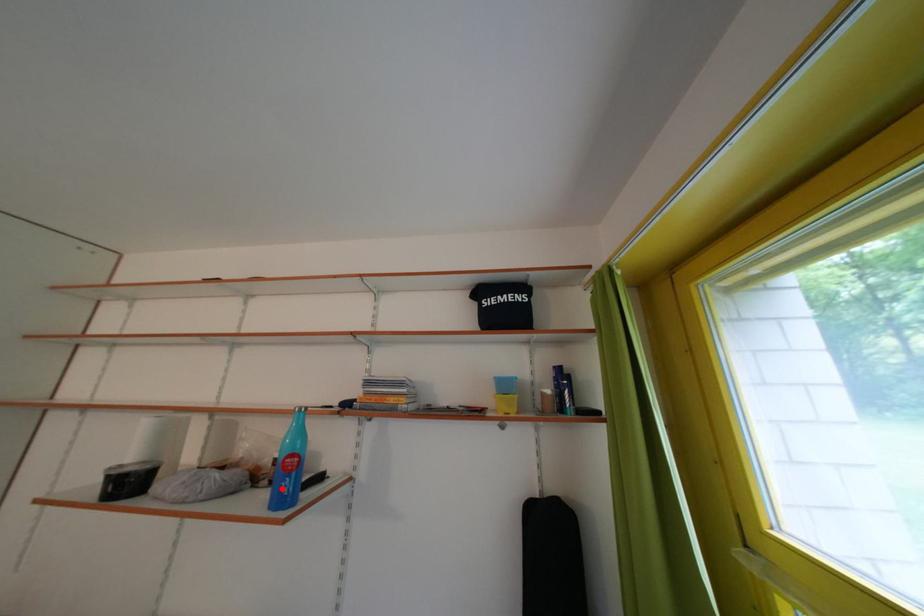
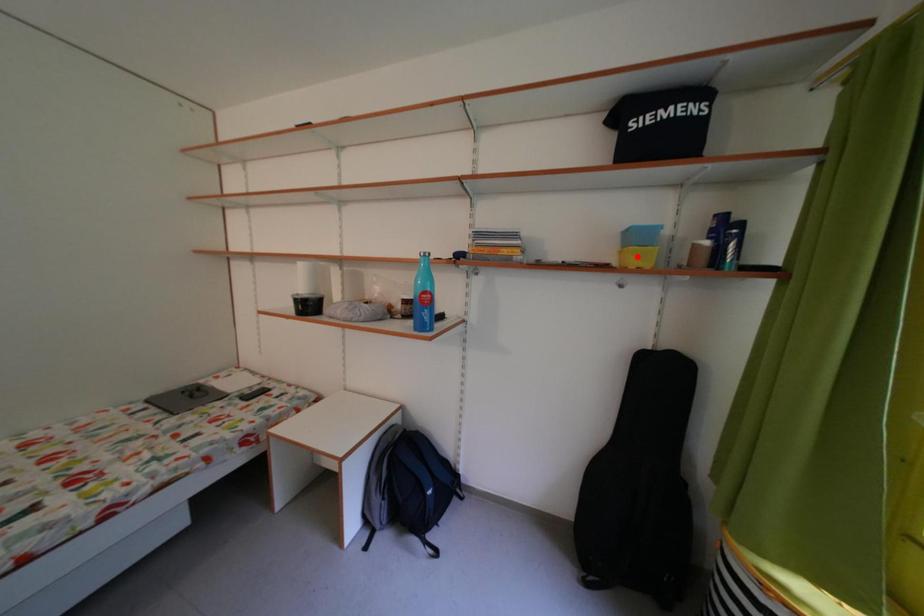
I am providing you with two images of the same scene from different viewpoints. A red point is marked on the first image and another point is marked on the second image. Is the red point in image1 aligned with the point shown in image2?

No